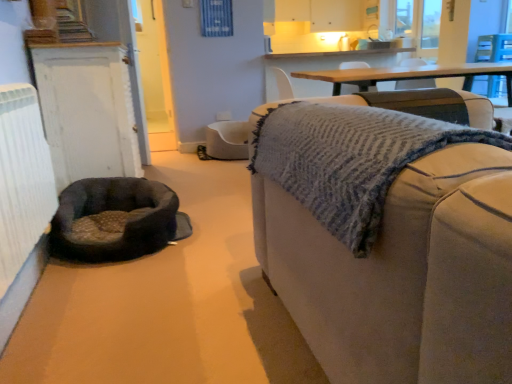
Question: Is beige fabric couch at right at the left side of white painted wood door at left?

Choices:
 (A) no
 (B) yes

Answer: (A)

Question: From the image's perspective, would you say beige fabric couch at right is positioned over white painted wood door at left?

Choices:
 (A) yes
 (B) no

Answer: (B)

Question: Is beige fabric couch at right positioned with its back to white painted wood door at left?

Choices:
 (A) no
 (B) yes

Answer: (A)

Question: Considering the relative sizes of beige fabric couch at right and white painted wood door at left in the image provided, is beige fabric couch at right shorter than white painted wood door at left?

Choices:
 (A) no
 (B) yes

Answer: (B)

Question: From a real-world perspective, is beige fabric couch at right under white painted wood door at left?

Choices:
 (A) no
 (B) yes

Answer: (B)

Question: Is point (128, 72) positioned closer to the camera than point (60, 238)?

Choices:
 (A) closer
 (B) farther

Answer: (B)

Question: In terms of size, does white painted wood door at left appear bigger or smaller than soft gray fabric dog bed at lower left?

Choices:
 (A) small
 (B) big

Answer: (B)

Question: From a real-world perspective, is white painted wood door at left physically located above or below soft gray fabric dog bed at lower left?

Choices:
 (A) below
 (B) above

Answer: (B)

Question: Considering the positions of white painted wood door at left and soft gray fabric dog bed at lower left in the image, is white painted wood door at left wider or thinner than soft gray fabric dog bed at lower left?

Choices:
 (A) thin
 (B) wide

Answer: (A)

Question: Looking at the image, does soft gray fabric dog bed at lower left seem bigger or smaller compared to white painted wood door at left?

Choices:
 (A) big
 (B) small

Answer: (B)

Question: In the image, is soft gray fabric dog bed at lower left positioned in front of or behind white painted wood door at left?

Choices:
 (A) front
 (B) behind

Answer: (A)

Question: From their relative heights in the image, would you say soft gray fabric dog bed at lower left is taller or shorter than white painted wood door at left?

Choices:
 (A) short
 (B) tall

Answer: (A)

Question: Is soft gray fabric dog bed at lower left wider or thinner than white painted wood door at left?

Choices:
 (A) wide
 (B) thin

Answer: (A)

Question: Looking at their shapes, would you say white painted wood door at left is wider or thinner than beige fabric couch at right?

Choices:
 (A) wide
 (B) thin

Answer: (B)

Question: Is white painted wood door at left taller or shorter than beige fabric couch at right?

Choices:
 (A) short
 (B) tall

Answer: (B)